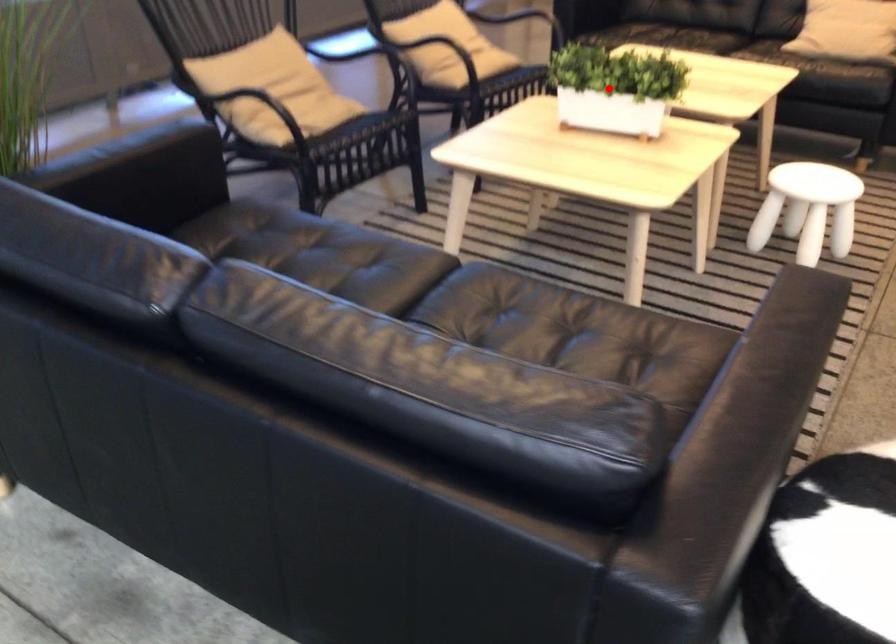
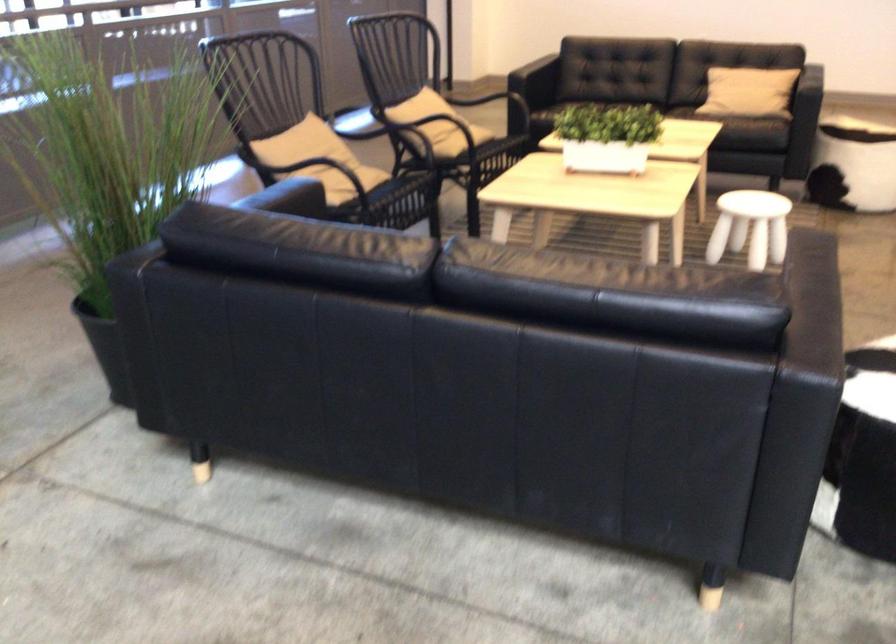
Where in the second image is the point corresponding to the highlighted location from the first image?

(607, 137)